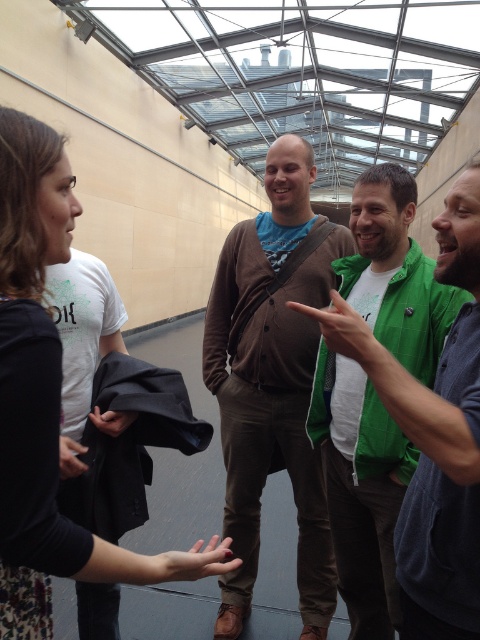
You are standing at the entrance of this indoor space and want to greet both the person in the brown cardigan at center and the person in the floral dress at left. Which individual should you approach first based on their positions?

You should approach the person in the brown cardigan at center first because they are positioned closer to you than the floral dress at left, who is further away.

Based on the photo, you are an interior designer assessing the spatial arrangement of the room. You notice the floral dress at left and the green mesh glove at center. Which object takes up more space in the image?

The floral dress at left is larger in size than the green mesh glove at center, so it takes up more space in the image.

Based on the photo, you are a photographer setting up a shoot in this space. You need to position a large backdrop that requires at least 2 meters of width. You see the floral dress at left and the black fabric at lower left. Which object can you use as a reference to estimate the required width for the backdrop?

The floral dress at left is wider than the black fabric at lower left, so you can use the floral dress at left as a reference to estimate the required width for the backdrop since it is wider.